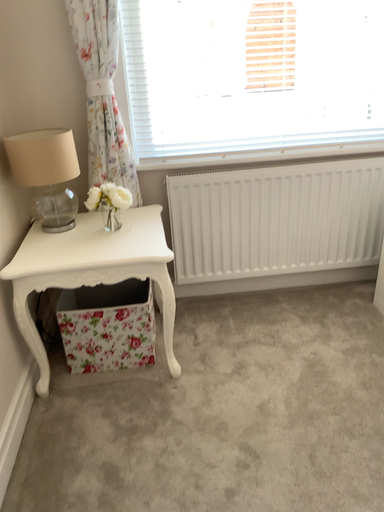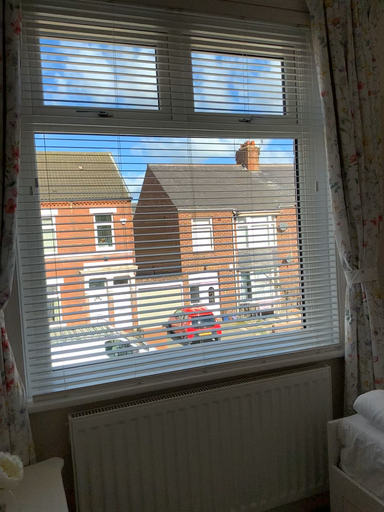
Question: How did the camera likely rotate when shooting the video?

Choices:
 (A) rotated left
 (B) rotated right

Answer: (B)